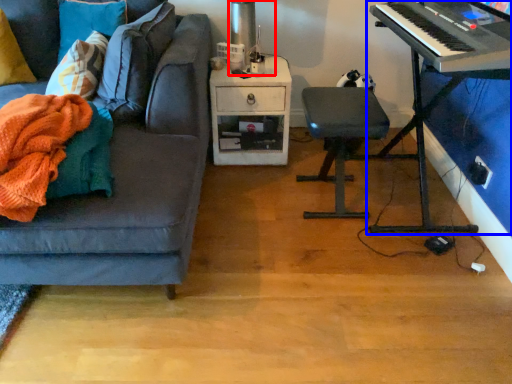
Question: Among these objects, which one is nearest to the camera, table lamp (highlighted by a red box) or piano (highlighted by a blue box)?

Choices:
 (A) table lamp
 (B) piano

Answer: (B)